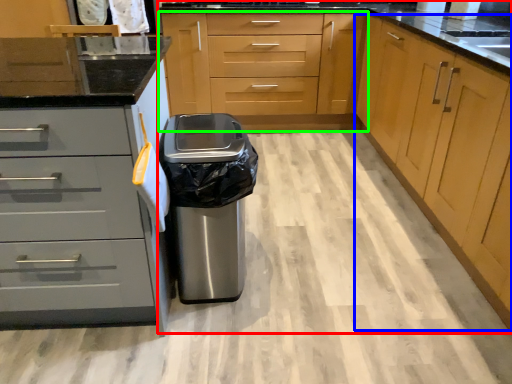
Question: Considering the real-world distances, which object is farthest from cabinetry (highlighted by a red box)? cabinetry (highlighted by a blue box) or cabinetry (highlighted by a green box)?

Choices:
 (A) cabinetry
 (B) cabinetry

Answer: (A)